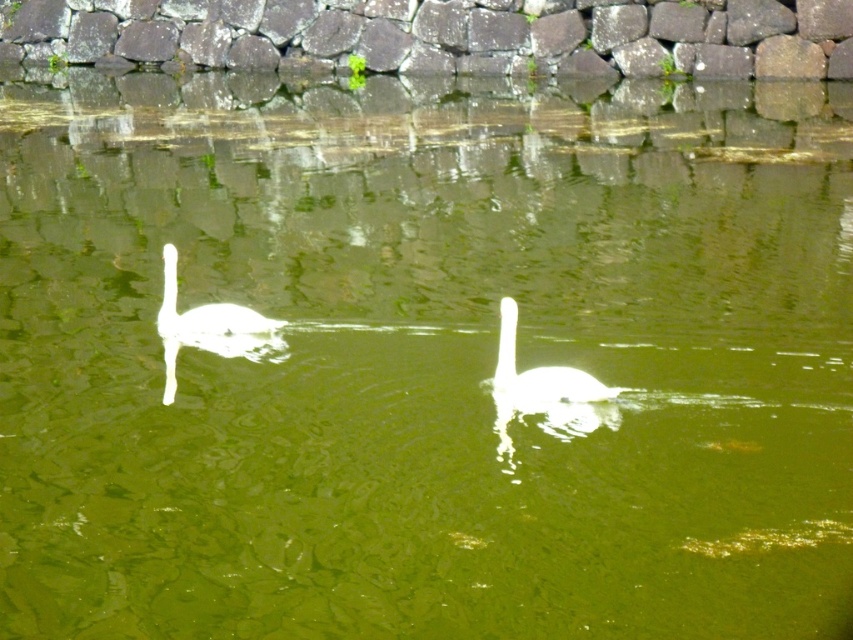
Can you confirm if white glossy swan at center is shorter than white glossy swan at left?

Yes.

Who is higher up, white glossy swan at center or white glossy swan at left?

white glossy swan at left is above.

Does point (576, 381) come in front of point (183, 326)?

Yes.

I want to click on white glossy swan at center, so click(540, 371).